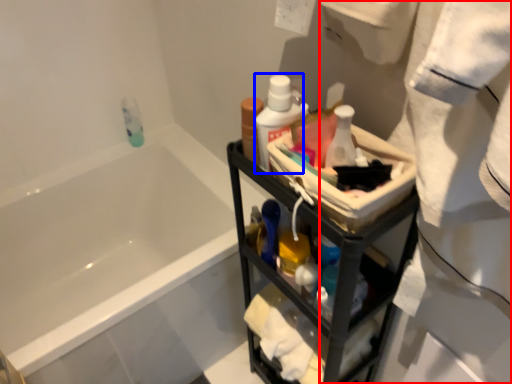
Question: Which object appears farthest to the camera in this image, bath towel (highlighted by a red box) or mouthwash (highlighted by a blue box)?

Choices:
 (A) bath towel
 (B) mouthwash

Answer: (B)